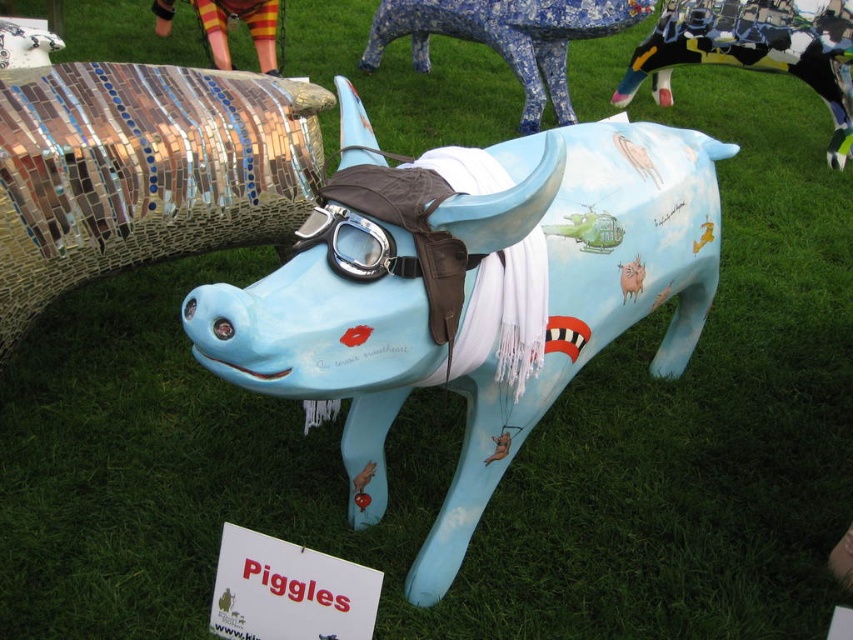
Question: Does black and white mosaic cow at upper right have a lesser width compared to blue mosaic cow at upper center?

Choices:
 (A) no
 (B) yes

Answer: (B)

Question: Among these objects, which one is farthest from the camera?

Choices:
 (A) clear plastic goggles at center
 (B) blue mosaic cow at upper center
 (C) black and white mosaic cow at upper right

Answer: (C)

Question: Which object appears farthest from the camera in this image?

Choices:
 (A) blue mosaic cow at upper center
 (B) black and white mosaic cow at upper right
 (C) clear plastic goggles at center

Answer: (B)

Question: Can you confirm if black and white mosaic cow at upper right is positioned to the left of blue mosaic cow at upper center?

Choices:
 (A) yes
 (B) no

Answer: (B)

Question: Which object is farther from the camera taking this photo?

Choices:
 (A) black and white mosaic cow at upper right
 (B) clear plastic goggles at center

Answer: (A)

Question: Does black and white mosaic cow at upper right appear under clear plastic goggles at center?

Choices:
 (A) yes
 (B) no

Answer: (B)